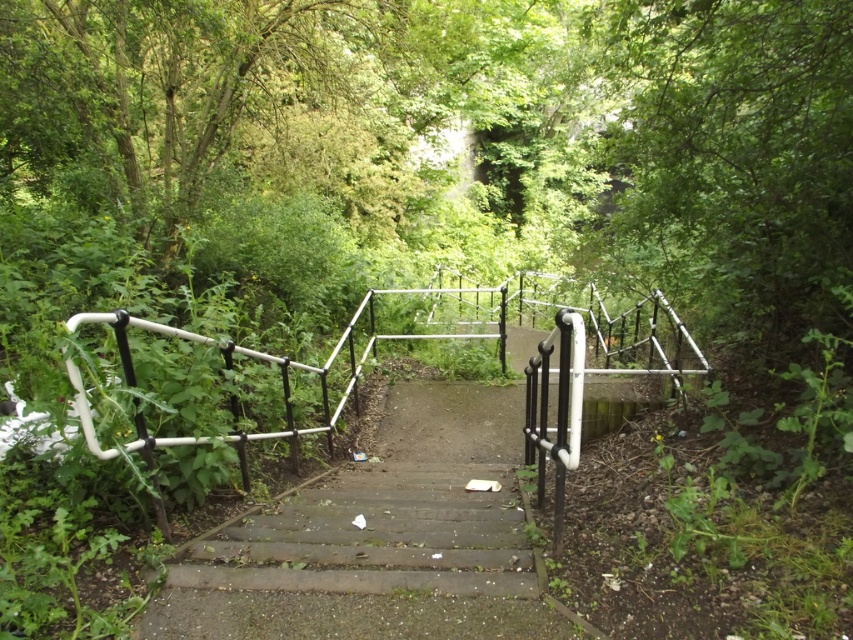
Question: Is green leafy tree at upper left further to camera compared to wooden stairs at center?

Choices:
 (A) yes
 (B) no

Answer: (A)

Question: Does green leafy tree at upper left appear under wooden stairs at center?

Choices:
 (A) no
 (B) yes

Answer: (A)

Question: Can you confirm if green leafy tree at upper left is positioned above wooden stairs at center?

Choices:
 (A) yes
 (B) no

Answer: (A)

Question: Which of the following is the farthest from the observer?

Choices:
 (A) green leafy tree at upper left
 (B) wooden stairs at center

Answer: (A)